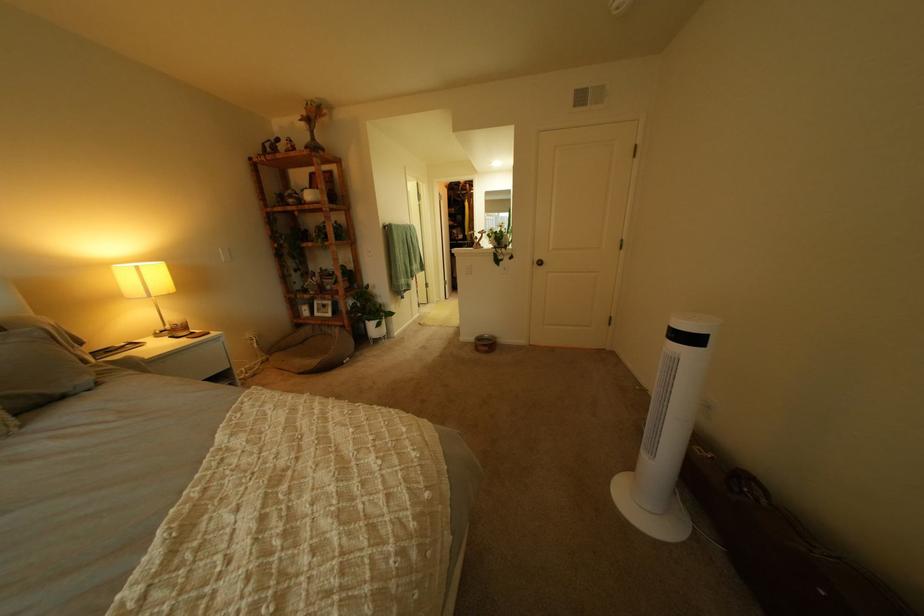
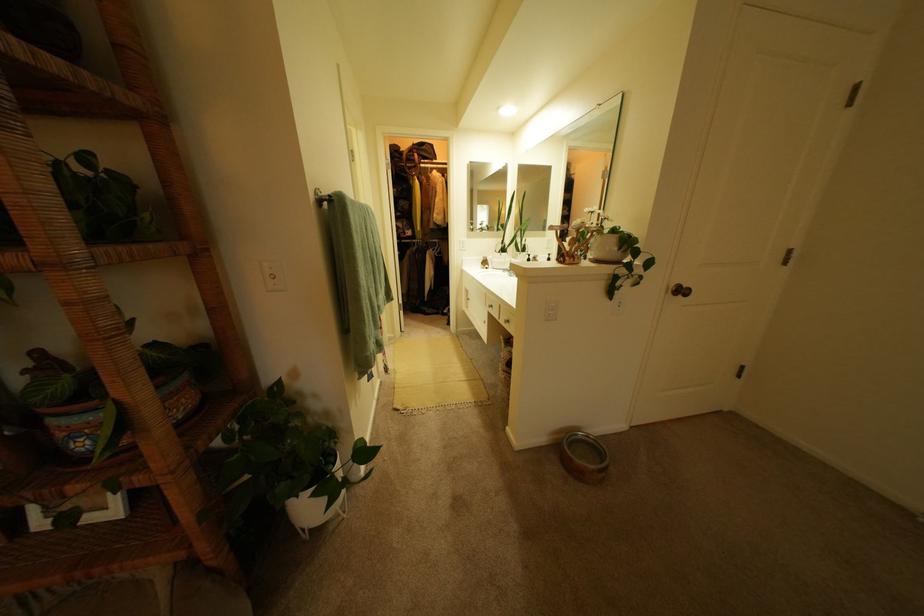
The images are taken continuously from a first-person perspective. In which direction are you moving?

The movement direction of the cameraman is left, forward.